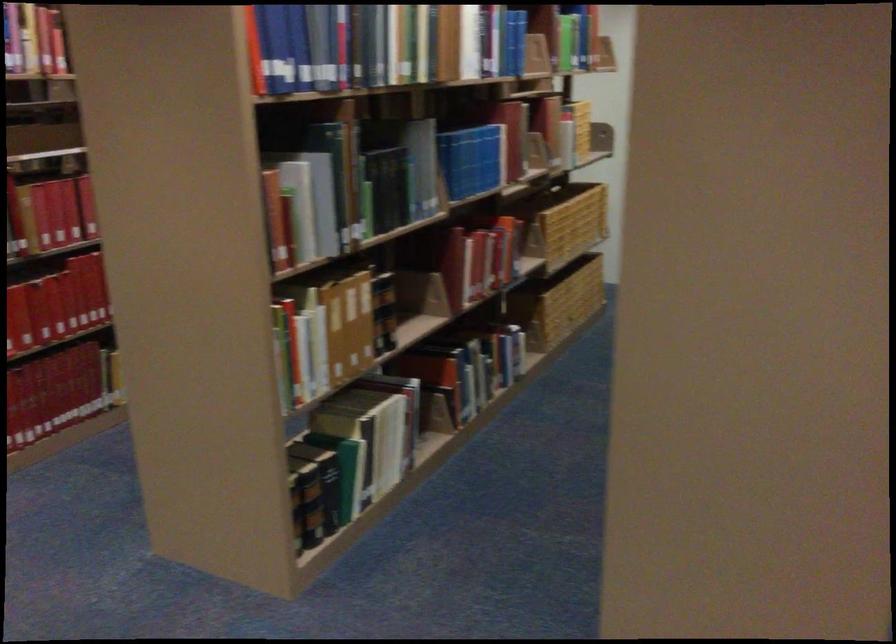
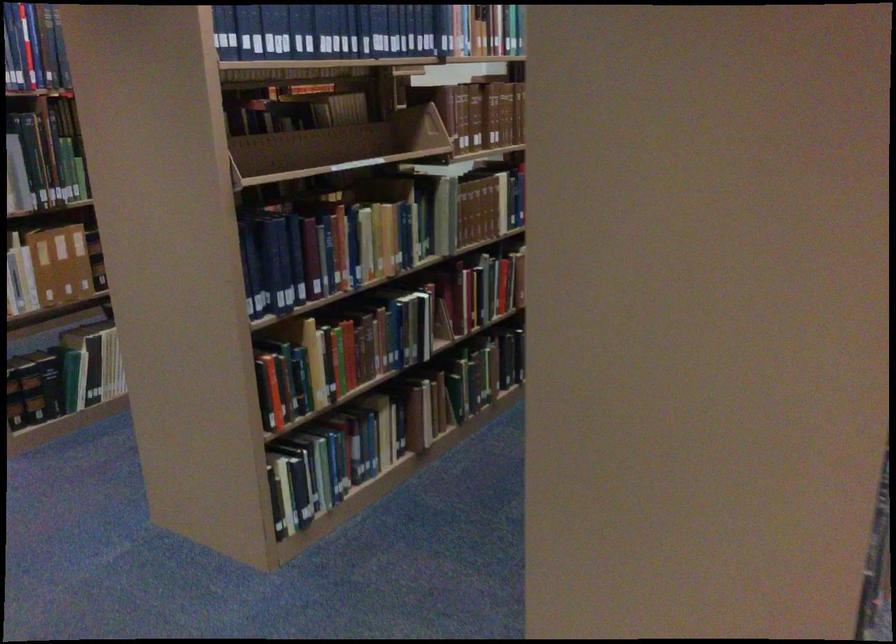
What movement of the cameraman would produce the second image?

The cameraman walked toward right, backward.